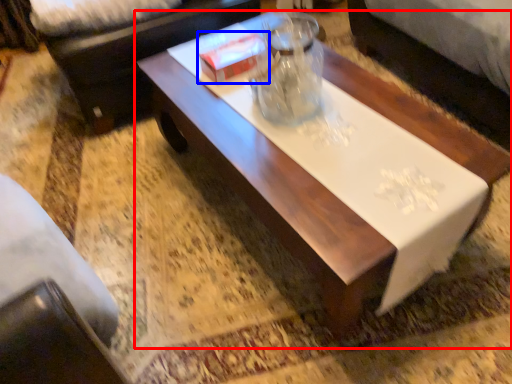
Question: Among these objects, which one is farthest to the camera, coffee table (highlighted by a red box) or box (highlighted by a blue box)?

Choices:
 (A) coffee table
 (B) box

Answer: (B)